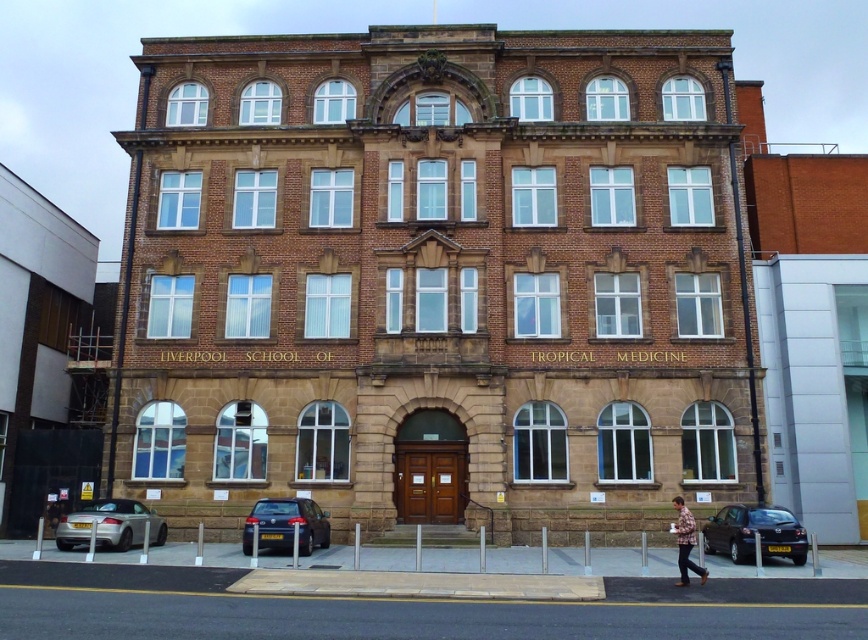
Question: Based on their relative distances, which object is nearer to the silver metallic car at lower left?

Choices:
 (A) matte black car at lower right
 (B) dark blue metallic car at lower left

Answer: (B)

Question: Among these points, which one is nearest to the camera?

Choices:
 (A) (99, 524)
 (B) (277, 538)
 (C) (681, 536)
 (D) (786, 544)

Answer: (C)

Question: Does dark blue metallic car at lower left appear on the right side of flannel shirt at lower right?

Choices:
 (A) no
 (B) yes

Answer: (A)

Question: Can you confirm if matte black car at lower right is wider than silver metallic car at lower left?

Choices:
 (A) yes
 (B) no

Answer: (B)

Question: Which point appears farthest from the camera in this image?

Choices:
 (A) (287, 520)
 (B) (112, 508)

Answer: (B)

Question: Does silver metallic car at lower left appear on the right side of flannel shirt at lower right?

Choices:
 (A) yes
 (B) no

Answer: (B)